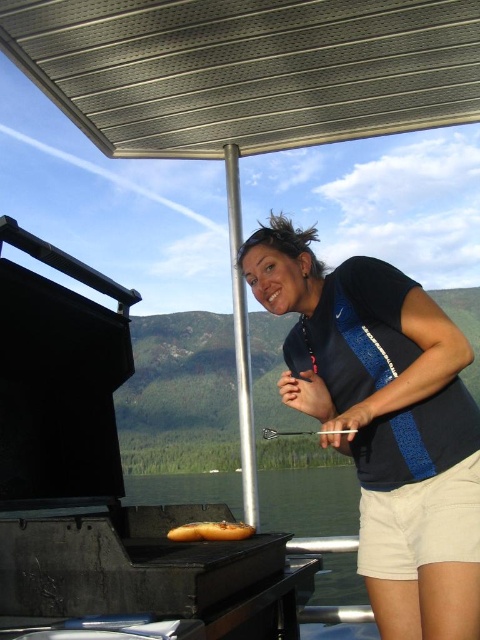
You are standing in the scene and want to place a small decoration between the two points labeled as point (x=344, y=58) and point (x=387, y=632). Which point should the decoration be closer to in order to appear closer to the camera?

The decoration should be closer to point (x=344, y=58) because it is further to the camera than point (x=387, y=632).

You are a photographer standing in front of the grill. You want to take a photo of both the black fabric shirt at center and the golden brown bread at center. Which object will appear larger in the photo?

The black fabric shirt at center will appear larger in the photo because it is closer to the viewer than the golden brown bread at center.

You are a chef standing in the kitchen and see a black fabric shirt at center and a golden brown bread at center. You need to place a 24 inch long platter between them. Will there be enough space?

The distance between the black fabric shirt at center and the golden brown bread at center is 20.56 inches. Since the platter is 24 inches long, it will not fit between them as the space is smaller than the platter.